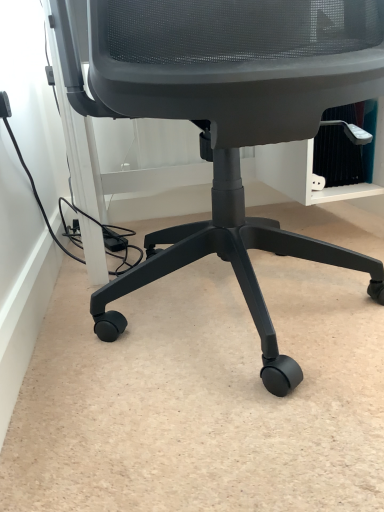
Image resolution: width=384 pixels, height=512 pixels. What do you see at coordinates (223, 121) in the screenshot? I see `matte black chair at center` at bounding box center [223, 121].

Where is `matte black chair at center`? matte black chair at center is located at coordinates (223, 121).

You are a GUI agent. You are given a task and a screenshot of the screen. Output one action in this format:
    pyautogui.click(x=<x>, y=<y>)
    Task: Click on the matte black chair at center
    
    Given the screenshot: What is the action you would take?
    pyautogui.click(x=223, y=121)